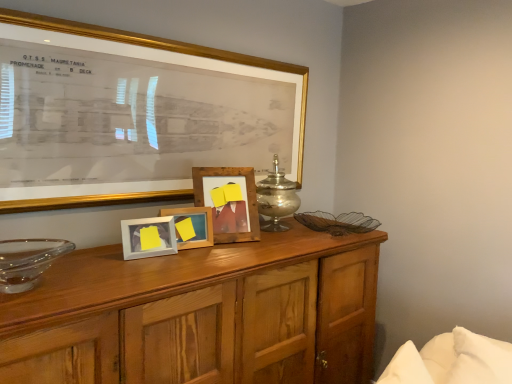
Identify the location of free spot to the left of white matte picture frame at center, which appears as the 2th picture frame when viewed from the front. (95, 249).